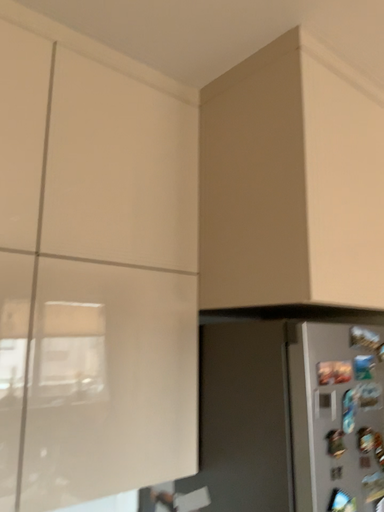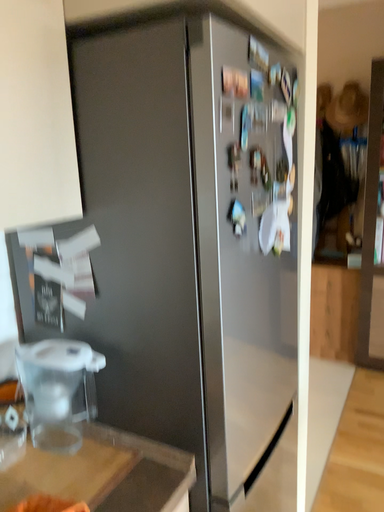
Question: How did the camera likely rotate when shooting the video?

Choices:
 (A) rotated downward
 (B) rotated upward

Answer: (A)